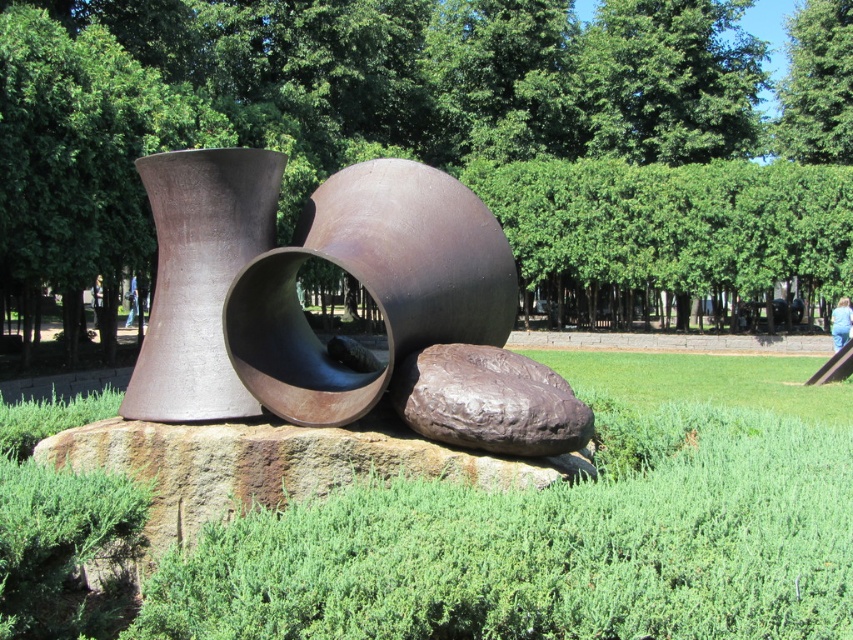
Consider the image. You are a park visitor standing in front of the sculpture. You see the matte brown vase at center and the rusty metallic boulder at center. Which object is positioned to the left?

The matte brown vase at center is to the left of the rusty metallic boulder at center.